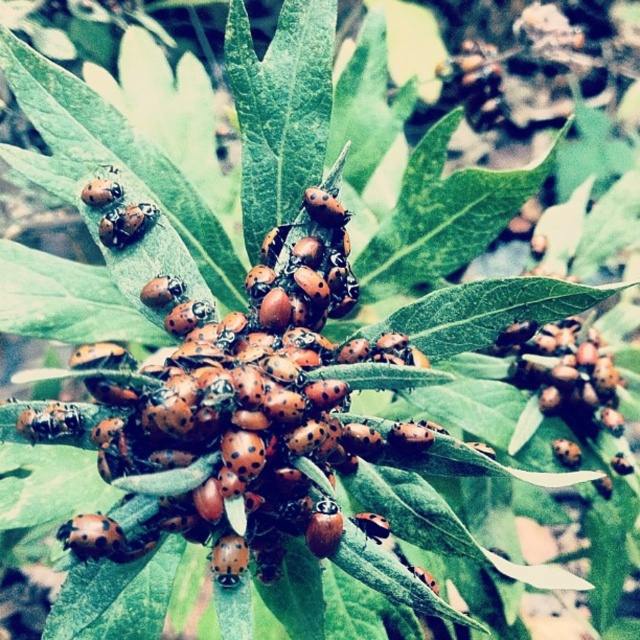
You are a small insect trying to cross from the green matte leaf at upper right to the orange matte ladybug at center. Which path would require less effort in terms of size constraints?

The path to the orange matte ladybug at center requires less effort because the green matte leaf at upper right is bigger, making it harder to navigate due to its larger size.

Looking at this image, you are a small insect trying to climb from the orange matte ladybug at center to the green matte leaf at upper right. Considering their heights, which direction should you move to reach the higher object?

The green matte leaf at upper right has a greater height compared to the orange matte ladybug at center. Therefore, you should move upward towards the green matte leaf at upper right to reach the higher object.